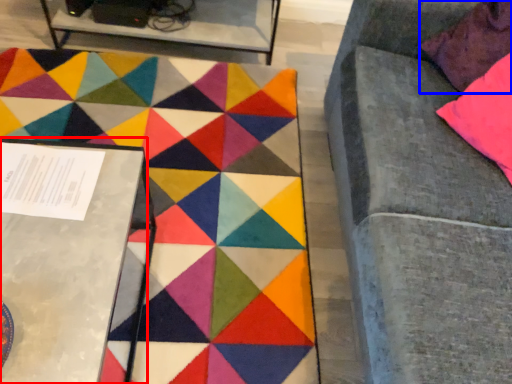
Question: Which point is further to the camera, table (highlighted by a red box) or pillow (highlighted by a blue box)?

Choices:
 (A) table
 (B) pillow

Answer: (B)